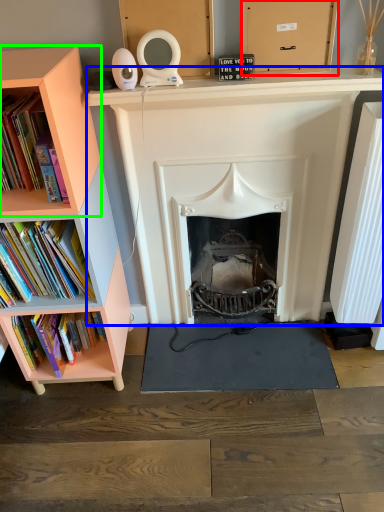
Question: Considering the real-world distances, which object is farthest from cardboard box (highlighted by a red box)? fireplace (highlighted by a blue box) or shelf (highlighted by a green box)?

Choices:
 (A) fireplace
 (B) shelf

Answer: (B)